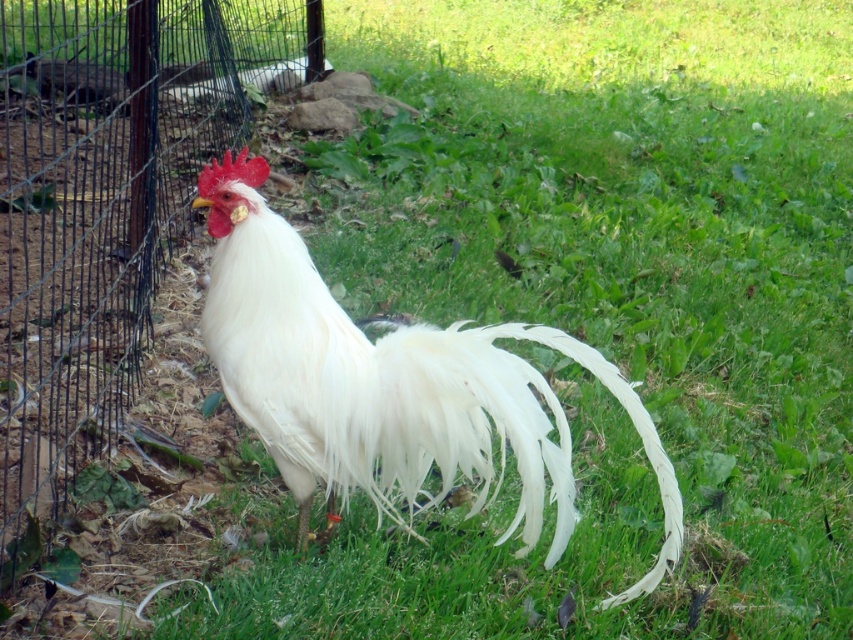
Question: Can you confirm if wire mesh fence at left is positioned above white feathered rooster at center?

Choices:
 (A) yes
 (B) no

Answer: (A)

Question: Does wire mesh fence at left have a lesser width compared to white feathered rooster at center?

Choices:
 (A) yes
 (B) no

Answer: (B)

Question: Which point is closer to the camera?

Choices:
 (A) wire mesh fence at left
 (B) white feathered rooster at center

Answer: (B)

Question: Which point is closer to the camera taking this photo?

Choices:
 (A) (142, 36)
 (B) (453, 339)

Answer: (B)

Question: Is wire mesh fence at left below white feathered rooster at center?

Choices:
 (A) yes
 (B) no

Answer: (B)